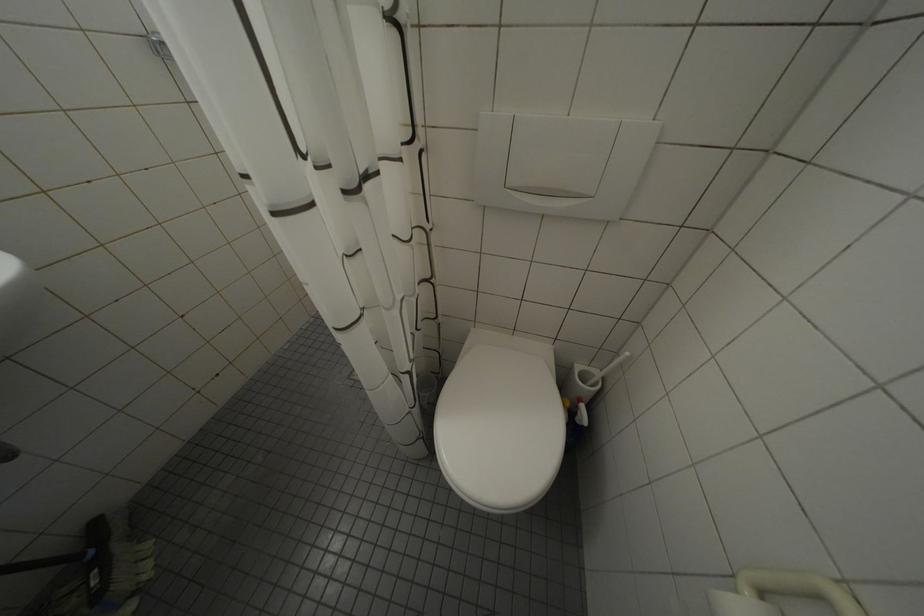
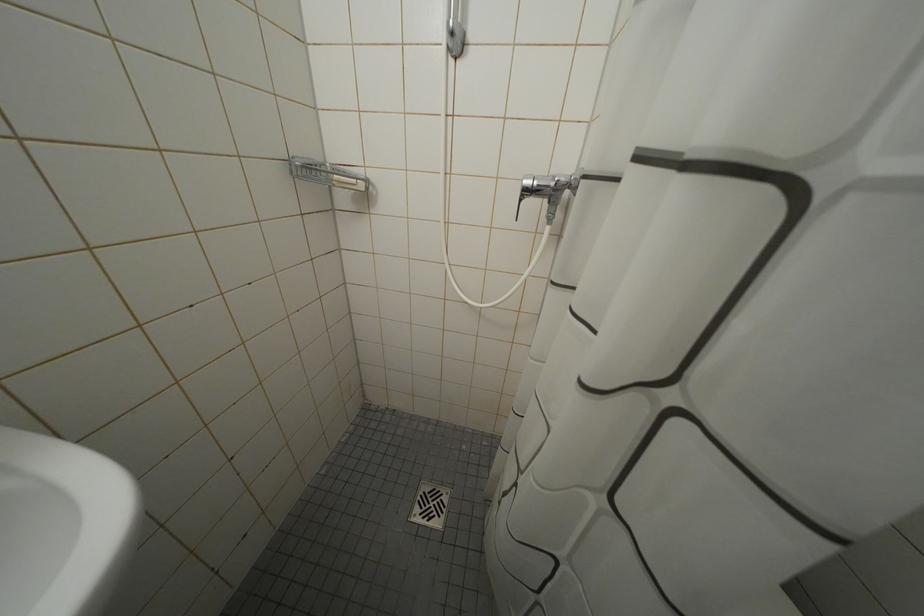
Question: Which direction would the cameraman need to move to produce the second image? Reply with the corresponding letter.

Choices:
 (A) Left
 (B) Right
 (C) Forward
 (D) Backward

Answer: (A)